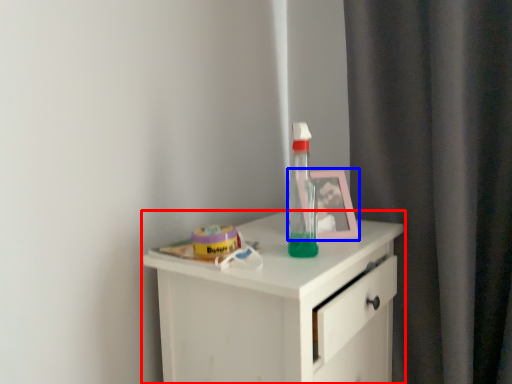
Question: Which of the following is the closest to the observer, chest of drawers (highlighted by a red box) or picture frame (highlighted by a blue box)?

Choices:
 (A) chest of drawers
 (B) picture frame

Answer: (A)